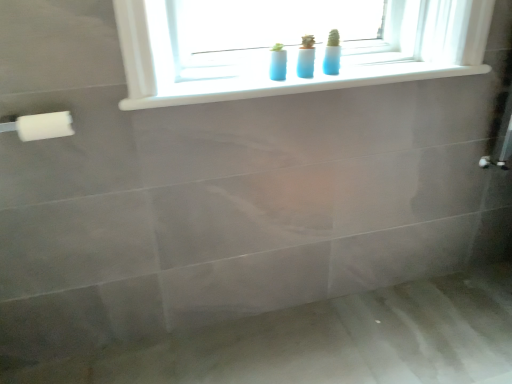
What is the approximate height of white plastic window sill at upper center?

white plastic window sill at upper center is 3.42 centimeters tall.

What do you see at coordinates (291, 84) in the screenshot?
I see `white plastic window sill at upper center` at bounding box center [291, 84].

The width and height of the screenshot is (512, 384). What do you see at coordinates (254, 267) in the screenshot? I see `matte gray bath at lower center` at bounding box center [254, 267].

From the picture: In order to face white plastic towel bar at left, should I rotate leftwards or rightwards?

A 27.175 degree turn to the left will do.

At what (x,y) coordinates should I click in order to perform the action: click on white plastic window sill at upper center. Please return your answer as a coordinate pair (x, y). This screenshot has height=384, width=512. Looking at the image, I should click on click(291, 84).

From the image's perspective, is white plastic towel bar at left located above or below matte gray bath at lower center?

From the image's perspective, white plastic towel bar at left appears above matte gray bath at lower center.

Which of these two, white plastic towel bar at left or matte gray bath at lower center, stands taller?

Standing taller between the two is white plastic towel bar at left.

Could you tell me if white plastic towel bar at left is turned towards matte gray bath at lower center?

Answer: No, white plastic towel bar at left is not facing towards matte gray bath at lower center.

Can you confirm if white plastic towel bar at left is positioned to the left of matte gray bath at lower center?

Yes, white plastic towel bar at left is to the left of matte gray bath at lower center.

Identify the location of bath below the white plastic window sill at upper center (from the image's perspective). (x=254, y=267).

Is point (345, 69) less distant than point (338, 320)?

Yes, it is in front of point (338, 320).

Which of these two, white plastic window sill at upper center or matte gray bath at lower center, is bigger?

With larger size is matte gray bath at lower center.

Considering the relative sizes of white plastic towel bar at left and white plastic window sill at upper center in the image provided, is white plastic towel bar at left thinner than white plastic window sill at upper center?

Correct, the width of white plastic towel bar at left is less than that of white plastic window sill at upper center.

Is white plastic towel bar at left far away from white plastic window sill at upper center?

white plastic towel bar at left is near white plastic window sill at upper center, not far away.

From a real-world perspective, which object stands above the other?

From a 3D spatial view, white plastic window sill at upper center is above.

Is the depth of white plastic towel bar at left greater than that of white plastic window sill at upper center?

No, the depth of white plastic towel bar at left is less than that of white plastic window sill at upper center.

Is matte gray bath at lower center situated inside white plastic window sill at upper center or outside?

matte gray bath at lower center is located beyond the bounds of white plastic window sill at upper center.

From a real-world perspective, is matte gray bath at lower center physically located above or below white plastic window sill at upper center?

From a real-world perspective, matte gray bath at lower center is physically below white plastic window sill at upper center.

Does matte gray bath at lower center come in front of white plastic window sill at upper center?

Yes, matte gray bath at lower center is in front of white plastic window sill at upper center.

Based on the photo, from their relative heights in the image, would you say white plastic window sill at upper center is taller or shorter than white plastic towel bar at left?

Considering their sizes, white plastic window sill at upper center has less height than white plastic towel bar at left.

Would you say white plastic window sill at upper center is a long distance from white plastic towel bar at left?

No.

How different are the orientations of white plastic window sill at upper center and white plastic towel bar at left in degrees?

The angle between the facing direction of white plastic window sill at upper center and the facing direction of white plastic towel bar at left is 0.975 degrees.

From a real-world perspective, which object stands above the other?

From a 3D spatial view, white plastic window sill at upper center is above.

What's the angular difference between matte gray bath at lower center and white plastic towel bar at left's facing directions?

The angular difference between matte gray bath at lower center and white plastic towel bar at left is 1.07 degrees.

Does matte gray bath at lower center have a greater height compared to white plastic towel bar at left?

No.

The height and width of the screenshot is (384, 512). Identify the location of towel bar that is on the left side of matte gray bath at lower center. (39, 124).

From a real-world perspective, between matte gray bath at lower center and white plastic towel bar at left, who is vertically lower?

matte gray bath at lower center.

The image size is (512, 384). Find the location of `bath on the right of the white plastic towel bar at left`. bath on the right of the white plastic towel bar at left is located at coordinates (254, 267).

In order to click on window sill that appears on the left of matte gray bath at lower center in this screenshot , I will do `click(291, 84)`.

When comparing their distances from white plastic towel bar at left, does matte gray bath at lower center or white plastic window sill at upper center seem further?

Among the two, matte gray bath at lower center is located further to white plastic towel bar at left.

Considering their positions, is white plastic window sill at upper center positioned closer to matte gray bath at lower center than white plastic towel bar at left?

Among the two, white plastic window sill at upper center is located nearer to matte gray bath at lower center.

Which object lies further to the anchor point white plastic window sill at upper center, white plastic towel bar at left or matte gray bath at lower center?

matte gray bath at lower center lies further to white plastic window sill at upper center than the other object.

Looking at the image, which one is located closer to matte gray bath at lower center, white plastic towel bar at left or white plastic window sill at upper center?

Among the two, white plastic window sill at upper center is located nearer to matte gray bath at lower center.

Considering their positions, is white plastic window sill at upper center positioned further to white plastic towel bar at left than matte gray bath at lower center?

Among the two, matte gray bath at lower center is located further to white plastic towel bar at left.

From the image, which object appears to be nearer to white plastic window sill at upper center, matte gray bath at lower center or white plastic towel bar at left?

Based on the image, white plastic towel bar at left appears to be nearer to white plastic window sill at upper center.

Locate an element on the screen. towel bar between white plastic window sill at upper center and matte gray bath at lower center in the up-down direction is located at coordinates (39, 124).